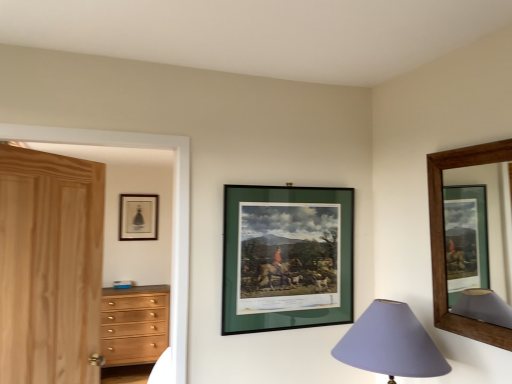
Question: In terms of size, does purple fabric lampshade at lower right appear bigger or smaller than green matte picture frame at center, the second picture frame positioned from the right?

Choices:
 (A) small
 (B) big

Answer: (B)

Question: From the image's perspective, is purple fabric lampshade at lower right located above or below green matte picture frame at center, which is the 2th picture frame from back to front?

Choices:
 (A) above
 (B) below

Answer: (B)

Question: Estimate the real-world distances between objects in this image. Which object is closer to the purple fabric lampshade at lower right?

Choices:
 (A) matte black frame at upper left, arranged as the 1th picture frame when viewed from the left
 (B) green matte picture frame at center, arranged as the 2th picture frame when viewed from the front
 (C) brown wooden picture frame at upper right, which is the 3th picture frame in left-to-right order
 (D) natural wood door at left
 (E) wooden chest of drawers at left

Answer: (C)

Question: Estimate the real-world distances between objects in this image. Which object is closer to the natural wood door at left?

Choices:
 (A) brown wooden picture frame at upper right, acting as the 1th picture frame starting from the front
 (B) purple fabric lampshade at lower right
 (C) wooden chest of drawers at left
 (D) matte black frame at upper left, arranged as the 1th picture frame when viewed from the left
 (E) green matte picture frame at center, which ranks as the second picture frame in left-to-right order

Answer: (E)